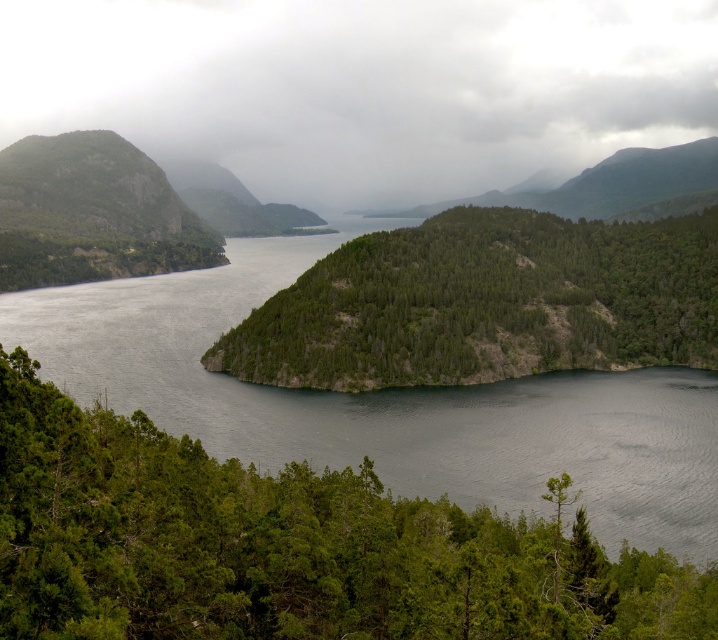
Who is positioned more to the right, green matte tree at center or green textured hillside at center?

From the viewer's perspective, green textured hillside at center appears more on the right side.

Is green matte tree at center to the left of green textured hillside at center from the viewer's perspective?

Yes, green matte tree at center is to the left of green textured hillside at center.

Does point (34, 385) come farther from viewer compared to point (370, 269)?

No, (34, 385) is in front of (370, 269).

Where is `green matte tree at center`? The width and height of the screenshot is (718, 640). green matte tree at center is located at coordinates (284, 547).

The image size is (718, 640). I want to click on green matte tree at center, so click(284, 547).

Which of these two, green matte tree at center or green forested mountain at upper center, stands shorter?

green matte tree at center

Find the location of `green matte tree at center`. green matte tree at center is located at coordinates (284, 547).

Does green textured hillside at center have a greater height compared to green forested mountain at upper center?

Incorrect, green textured hillside at center's height is not larger of green forested mountain at upper center's.

Does green textured hillside at center have a smaller size compared to green forested mountain at upper center?

Yes, green textured hillside at center is smaller than green forested mountain at upper center.

The image size is (718, 640). What do you see at coordinates (485, 304) in the screenshot?
I see `green textured hillside at center` at bounding box center [485, 304].

Find the location of a particular element. This screenshot has width=718, height=640. green textured hillside at center is located at coordinates (485, 304).